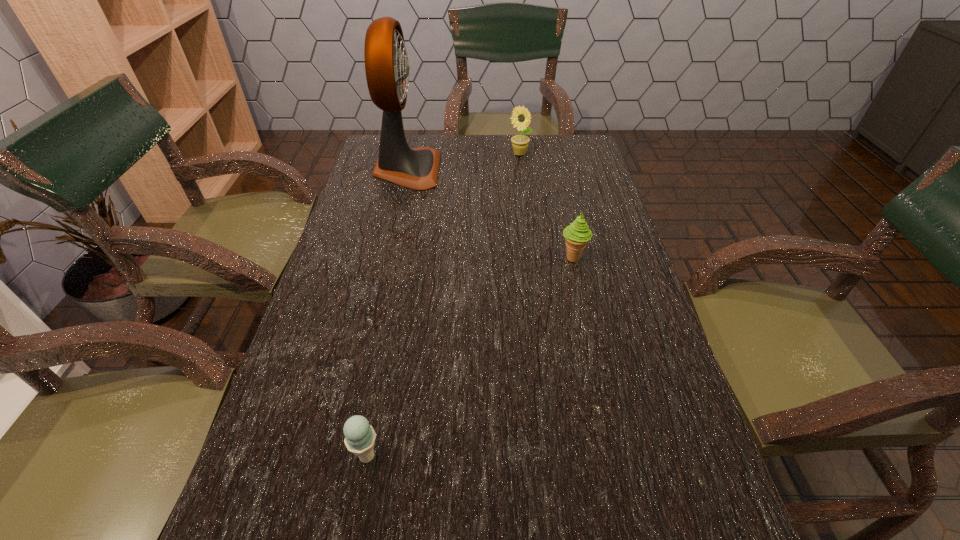
Find the location of a particular element. This screenshot has height=540, width=960. blank space that satisfies the following two spatial constraints: 1. on the front-facing side of the tallest object; 2. on the back side of the nearer ice cream is located at coordinates (342, 456).